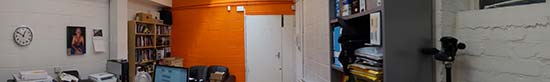
In order to click on poster in this screenshot , I will do `click(80, 41)`.